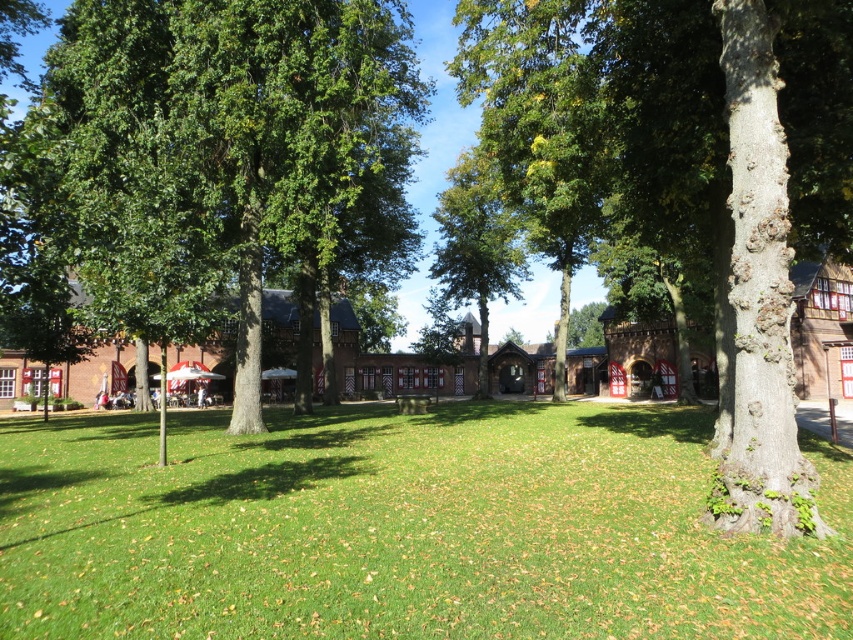
Question: Does green grass at center appear under green leafy tree at left?

Choices:
 (A) no
 (B) yes

Answer: (B)

Question: Does green grass at center have a greater width compared to green leafy tree at left?

Choices:
 (A) yes
 (B) no

Answer: (A)

Question: Which object is farther from the camera taking this photo?

Choices:
 (A) green leafy tree at center
 (B) green grass at center

Answer: (A)

Question: In this image, where is green grass at center located relative to green leafy tree at center?

Choices:
 (A) below
 (B) above

Answer: (A)

Question: Among these objects, which one is nearest to the camera?

Choices:
 (A) green leafy tree at center
 (B) green grass at center
 (C) green leafy tree at left

Answer: (B)

Question: Among these points, which one is farthest from the camera?

Choices:
 (A) (103, 193)
 (B) (442, 496)

Answer: (A)